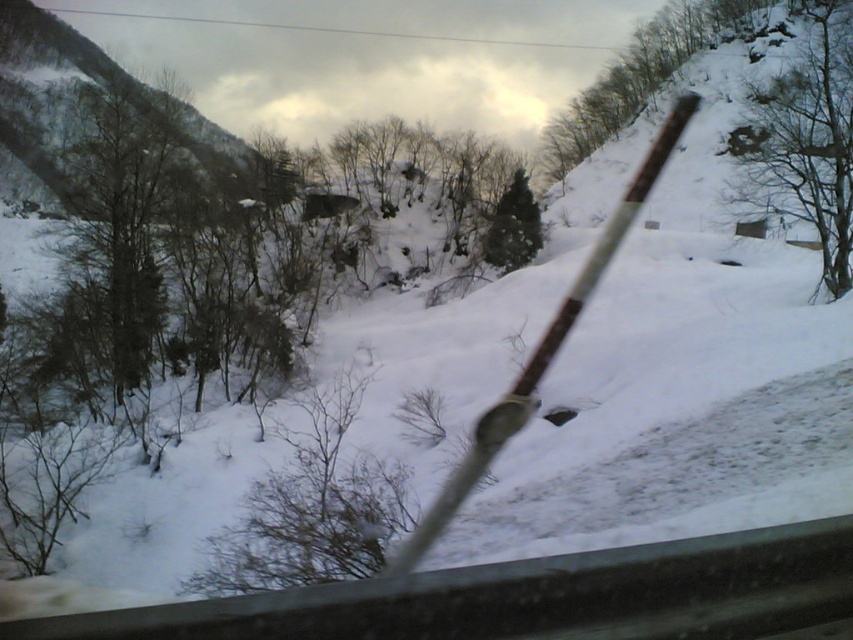
You are driving a car and notice two trees outside your windshield. The green leafy tree at upper center and the green matte tree at center are visible. How far apart are these two trees?

The green leafy tree at upper center is 35.56 meters from the green matte tree at center.

Consider the image. You are driving a car and want to know how far the point at coordinates (x=840, y=13) is from your current position. Can you determine the distance?

The point at coordinates (x=840, y=13) is 73.09 meters away from the camera, so the distance from your current position in the car is approximately 73.09 meters.

You are inside a car and looking through the windshield. You notice a brown textured bush at center. Based on its 2D position, can you estimate where it is located in the scene?

The brown textured bush at center is located at the 2D coordinates point (311, 508), which places it near the lower middle part of the windshield view.